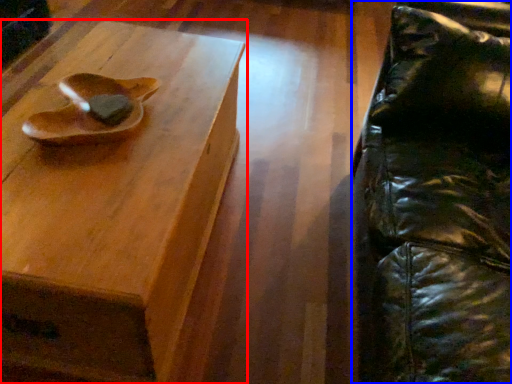
Question: Among these objects, which one is nearest to the camera, table (highlighted by a red box) or swivel chair (highlighted by a blue box)?

Choices:
 (A) table
 (B) swivel chair

Answer: (B)